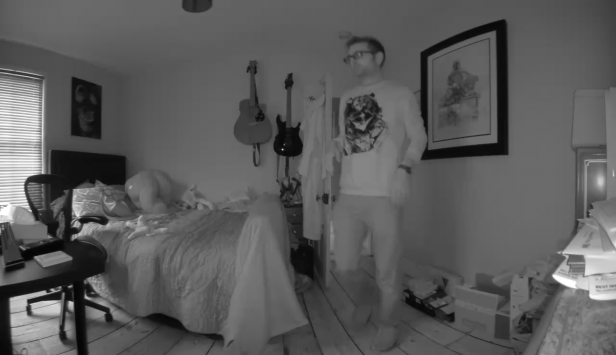
What are the coordinates of `ceiling` in the screenshot? It's located at (108, 19).